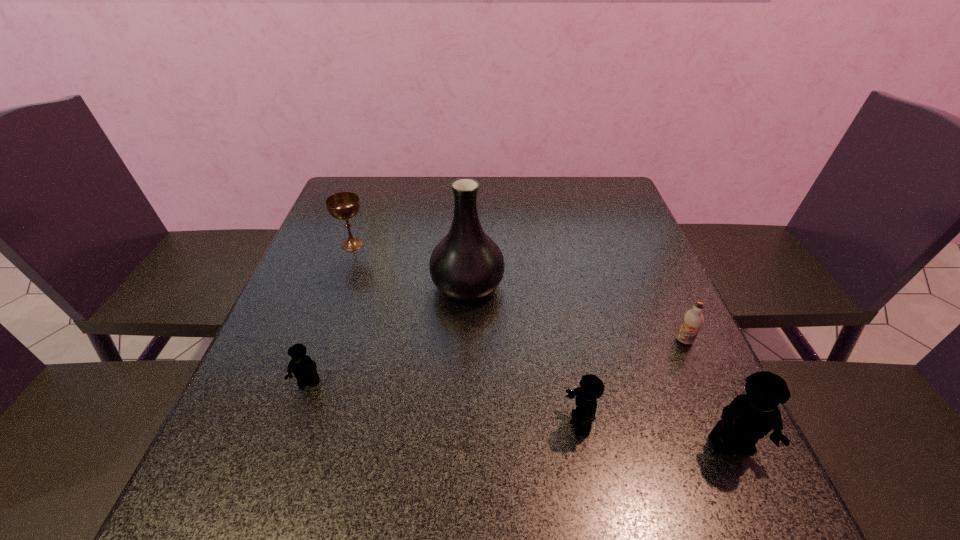
Identify the location of the farthest Lego. Image resolution: width=960 pixels, height=540 pixels. (304, 369).

Find the location of `the shortest Lego`. the shortest Lego is located at coordinates (304, 369).

Where is `the fourth object from left to right`? This screenshot has height=540, width=960. the fourth object from left to right is located at coordinates (591, 387).

Locate an element on the screen. The width and height of the screenshot is (960, 540). the second Lego from right to left is located at coordinates (591, 387).

The height and width of the screenshot is (540, 960). I want to click on the tallest Lego, so click(x=750, y=416).

Locate an element on the screen. the rightmost Lego is located at coordinates (750, 416).

What are the coordinates of `the farthest object` in the screenshot? It's located at click(x=344, y=205).

This screenshot has height=540, width=960. I want to click on vase, so click(x=466, y=264).

Where is `the fifth nearest object`? The image size is (960, 540). the fifth nearest object is located at coordinates (466, 264).

The width and height of the screenshot is (960, 540). I want to click on chocolate milk, so click(x=693, y=320).